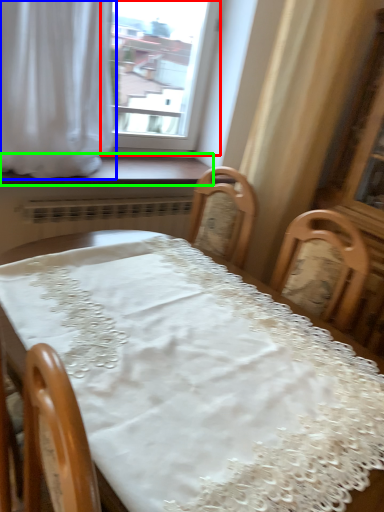
Question: Which is farther away from window (highlighted by a red box)? curtain (highlighted by a blue box) or window sill (highlighted by a green box)?

Choices:
 (A) curtain
 (B) window sill

Answer: (A)